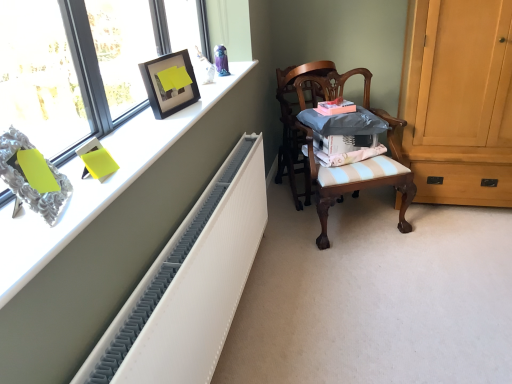
Question: Is white textured radiator at upper left wider than wooden chair at center, placed as the 1th chair when sorted from front to back?

Choices:
 (A) no
 (B) yes

Answer: (A)

Question: Is white textured radiator at upper left to the right of wooden chair at center, placed as the 2th chair when sorted from back to front, from the viewer's perspective?

Choices:
 (A) no
 (B) yes

Answer: (A)

Question: Does white textured radiator at upper left appear on the left side of wooden chair at center, placed as the 1th chair when sorted from front to back?

Choices:
 (A) no
 (B) yes

Answer: (B)

Question: From a real-world perspective, is white textured radiator at upper left physically above wooden chair at center, placed as the 1th chair when sorted from front to back?

Choices:
 (A) no
 (B) yes

Answer: (B)

Question: Can you confirm if white textured radiator at upper left is shorter than wooden chair at center, placed as the 1th chair when sorted from front to back?

Choices:
 (A) yes
 (B) no

Answer: (A)

Question: Does white textured radiator at upper left have a smaller size compared to wooden chair at center, placed as the 2th chair when sorted from back to front?

Choices:
 (A) no
 (B) yes

Answer: (B)

Question: From the image's perspective, would you say white textured radiator at upper left is shown under wooden chair at center, the 1th chair from the back?

Choices:
 (A) yes
 (B) no

Answer: (A)

Question: Does white textured radiator at upper left appear on the left side of wooden chair at center, marked as the second chair in a front-to-back arrangement?

Choices:
 (A) yes
 (B) no

Answer: (A)

Question: Is white textured radiator at upper left outside wooden chair at center, the 1th chair from the back?

Choices:
 (A) yes
 (B) no

Answer: (A)

Question: Considering the relative sizes of white textured radiator at upper left and wooden chair at center, the 1th chair from the back, in the image provided, is white textured radiator at upper left taller than wooden chair at center, the 1th chair from the back,?

Choices:
 (A) yes
 (B) no

Answer: (B)

Question: Considering the relative positions of white textured radiator at upper left and wooden chair at center, the 1th chair from the back, in the image provided, is white textured radiator at upper left to the right of wooden chair at center, the 1th chair from the back, from the viewer's perspective?

Choices:
 (A) no
 (B) yes

Answer: (A)

Question: From the image's perspective, is white textured radiator at upper left located above wooden chair at center, marked as the second chair in a front-to-back arrangement?

Choices:
 (A) no
 (B) yes

Answer: (A)

Question: Is light brown wood cabinet at right thinner than white textured radiator at left?

Choices:
 (A) no
 (B) yes

Answer: (A)